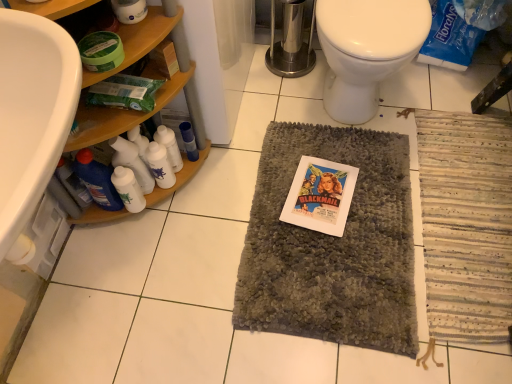
At what (x,y) coordinates should I click in order to perform the action: click on free space behind gray shaggy mat at center. Please return your answer as a coordinate pair (x, y). This screenshot has width=512, height=384. Looking at the image, I should click on (326, 104).